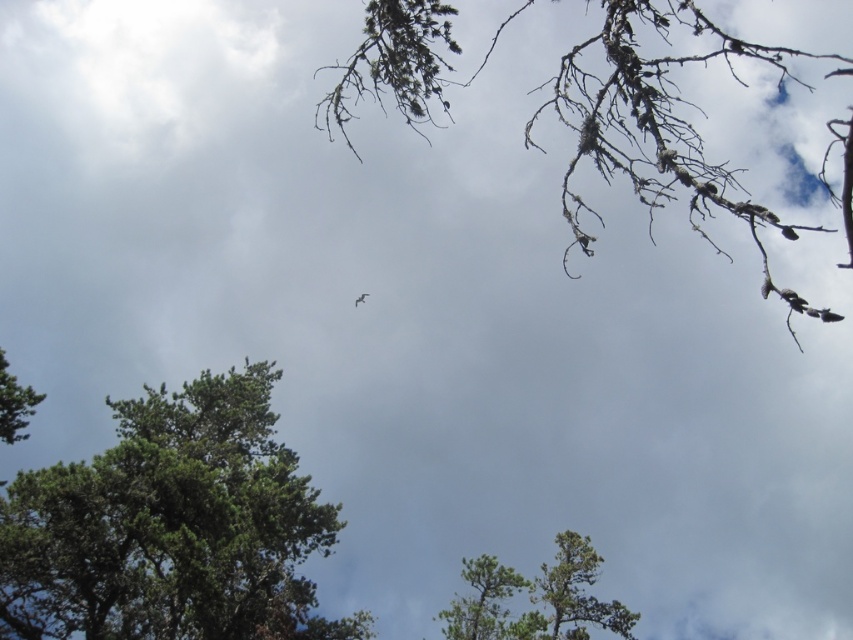
Question: Does green matte tree at center appear over green matte tree at lower left?

Choices:
 (A) yes
 (B) no

Answer: (B)

Question: Which point is farther from the camera taking this photo?

Choices:
 (A) (566, 547)
 (B) (469, 621)
 (C) (3, 582)

Answer: (A)

Question: Considering the real-world distances, which object is closest to the green matte tree at lower left?

Choices:
 (A) green matte tree at lower center
 (B) dead wood branches at upper right
 (C) green leafy tree at upper left

Answer: (C)

Question: Is green leafy tree at upper left bigger than green matte tree at center?

Choices:
 (A) no
 (B) yes

Answer: (B)

Question: Is green matte tree at center to the right of green matte tree at lower left from the viewer's perspective?

Choices:
 (A) no
 (B) yes

Answer: (B)

Question: Which point appears farthest from the camera in this image?

Choices:
 (A) (647, 61)
 (B) (20, 410)
 (C) (566, 584)
 (D) (485, 582)

Answer: (D)